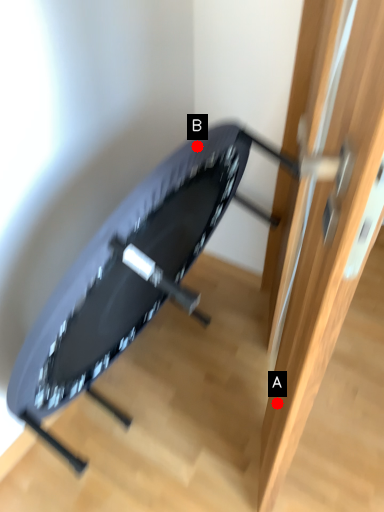
Question: Two points are circled on the image, labeled by A and B beside each circle. Which point appears closest to the camera in this image?

Choices:
 (A) A is closer
 (B) B is closer

Answer: (B)